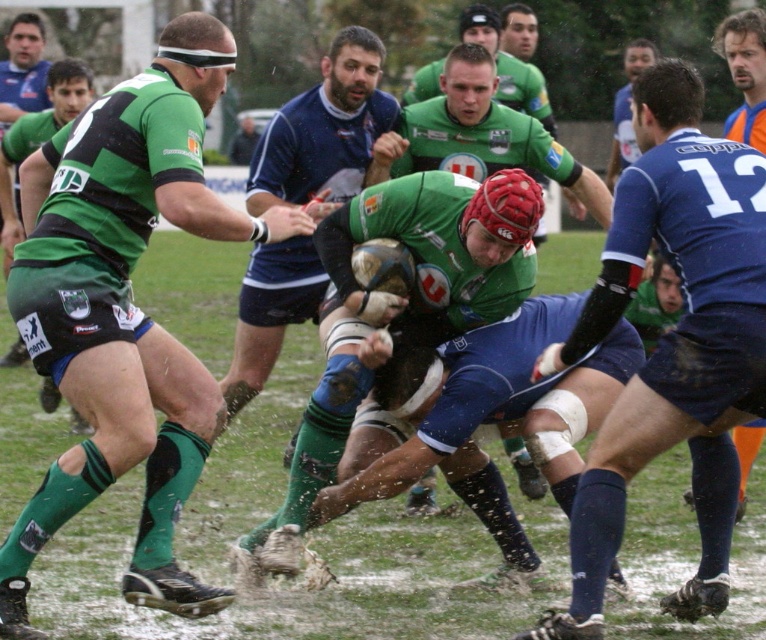
You are a referee observing the rugby match. You notice the green jersey at center and the blue matte jersey at center are both vying for the ball. Which player is positioned higher up in the image?

The green jersey at center has a greater height compared to the blue matte jersey at center, so the player in the green jersey at center is positioned higher up in the image.

You are a referee observing the rugby match and need to ensure players are within the field boundaries. Given that the field is 70 meters wide, can both the green jersey at center and the blue matte jersey at center fit side by side without exceeding the field width?

The green jersey at center is wider than the blue matte jersey at center. However, without knowing their exact widths, it is impossible to determine if their combined width exceeds 70 meters. More information is needed.